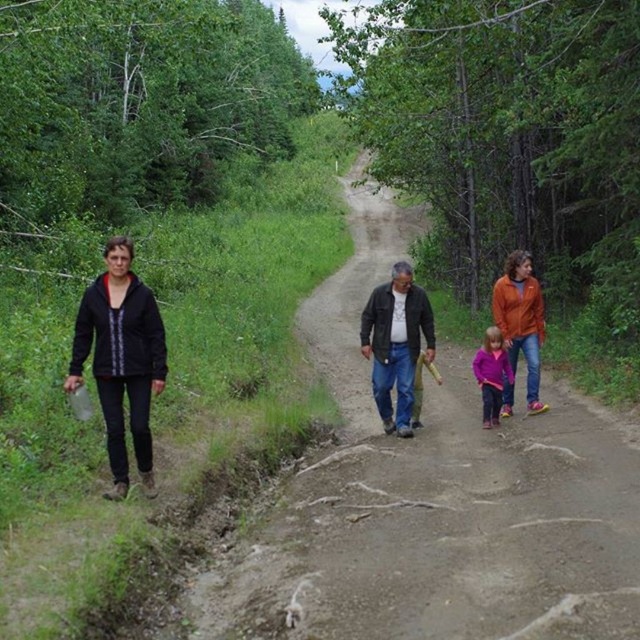
From the picture: Does black matte jacket at left have a greater height compared to orange fleece jacket at center-right?

Yes, black matte jacket at left is taller than orange fleece jacket at center-right.

This screenshot has width=640, height=640. What do you see at coordinates (122, 358) in the screenshot?
I see `black matte jacket at left` at bounding box center [122, 358].

Image resolution: width=640 pixels, height=640 pixels. In order to click on black matte jacket at left in this screenshot , I will do `click(122, 358)`.

Does black matte jacket at left have a greater height compared to purple fleece jacket at center?

A: Correct, black matte jacket at left is much taller as purple fleece jacket at center.

Who is more forward, [96,355] or [488,328]?

Point [96,355]

Between point (152, 493) and point (484, 406), which one is positioned behind?

The point (484, 406) is behind.

Where is `black matte jacket at left`? This screenshot has height=640, width=640. black matte jacket at left is located at coordinates (122, 358).

Which is in front, point (392, 275) or point (422, 330)?

Point (392, 275) is more forward.

Is dark brown leather jacket at center to the right of orange fleece jacket at center from the viewer's perspective?

No, dark brown leather jacket at center is not to the right of orange fleece jacket at center.

Find the location of a particular element. Image resolution: width=640 pixels, height=640 pixels. dark brown leather jacket at center is located at coordinates (396, 344).